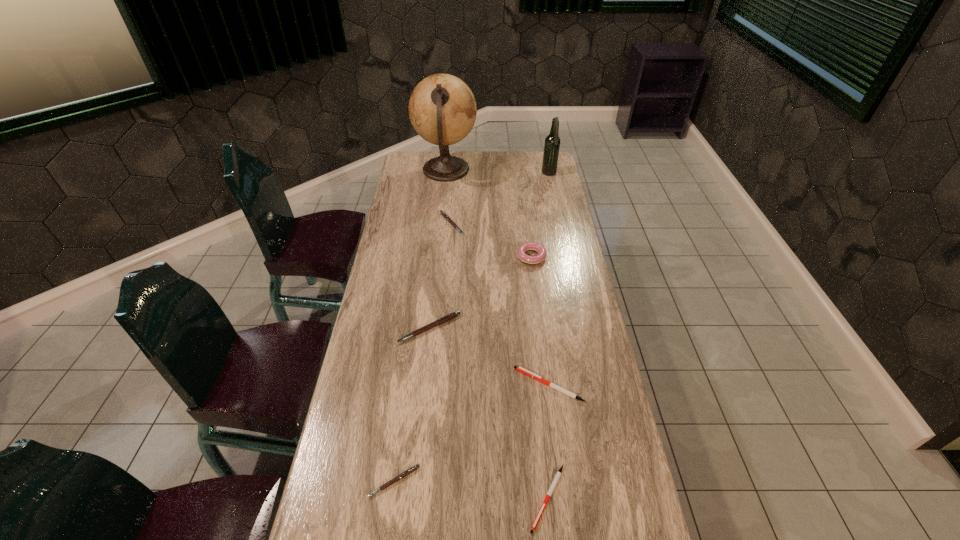
Locate an element on the screen. Image resolution: width=960 pixels, height=540 pixels. globe is located at coordinates (442, 109).

In order to click on beer bottle in this screenshot , I will do `click(552, 142)`.

Where is `dark beer bottle`? This screenshot has width=960, height=540. dark beer bottle is located at coordinates (552, 142).

Where is `the third tallest object`? the third tallest object is located at coordinates (529, 246).

Image resolution: width=960 pixels, height=540 pixels. I want to click on doughnut, so click(529, 246).

The image size is (960, 540). Find the location of `the biggest pink pen`. the biggest pink pen is located at coordinates (450, 316).

Identify the location of the tallest pen. (450, 316).

Find the location of `the second smallest pink pen`. the second smallest pink pen is located at coordinates (444, 215).

The height and width of the screenshot is (540, 960). Find the location of `the sixth nearest object`. the sixth nearest object is located at coordinates (444, 215).

The height and width of the screenshot is (540, 960). I want to click on the third nearest object, so click(x=520, y=369).